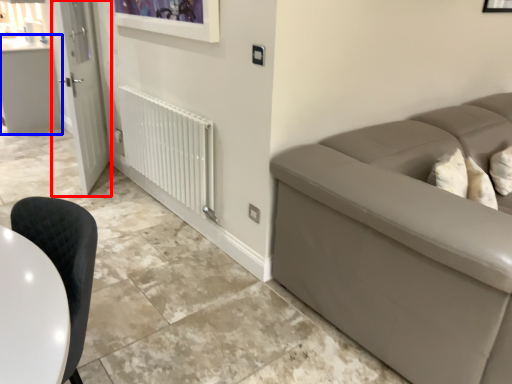
Question: Which object appears closest to the camera in this image, door (highlighted by a red box) or counter top (highlighted by a blue box)?

Choices:
 (A) door
 (B) counter top

Answer: (A)